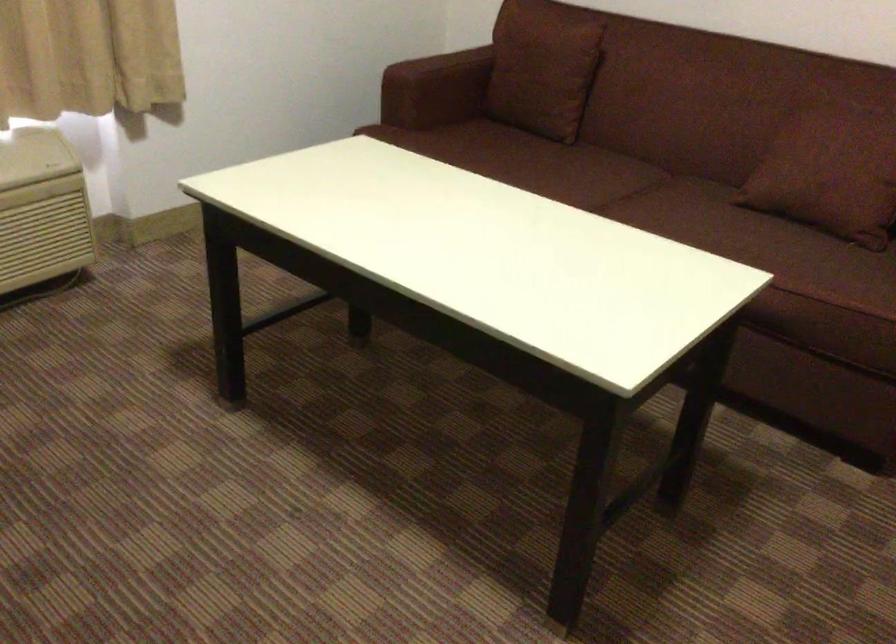
Where would you sit the sofa sitting surface? Please return your answer as a coordinate pair (x, y).

(574, 176)